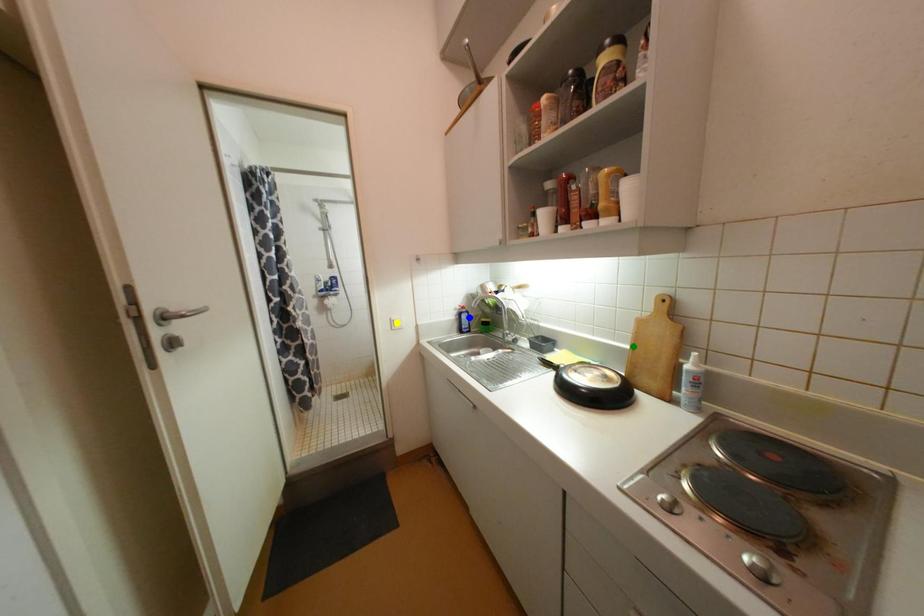
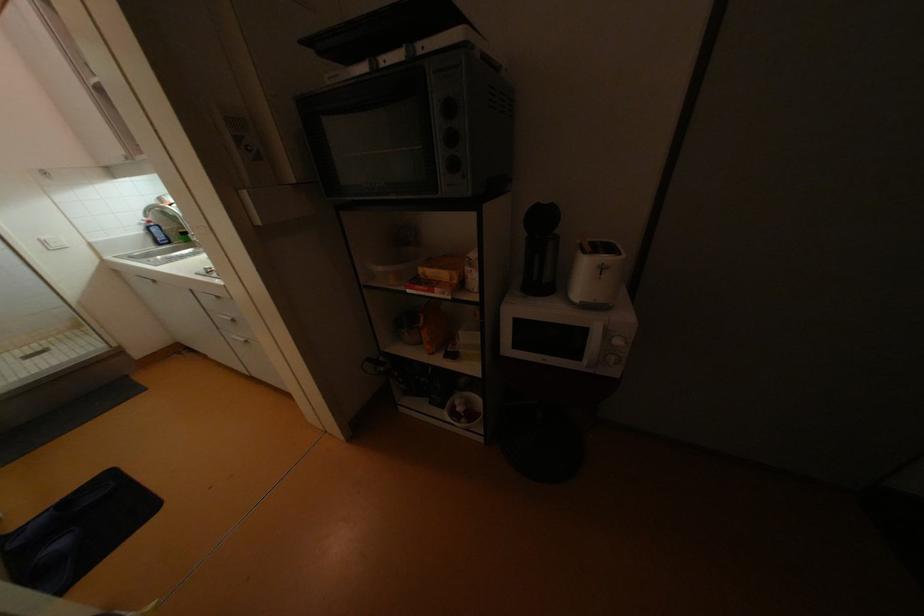
I am providing you with two images of the same scene from different viewpoints. Three points are marked in image1. Which point corresponds to a part or object that is occluded in image2?In image1, three points are marked. Which of them correspond to a part or object that is occluded in image2?Among the three points shown in image1, which one corresponds to a part or object that is no longer visible due to occlusion in image2?

green point cannot be seen in image2.